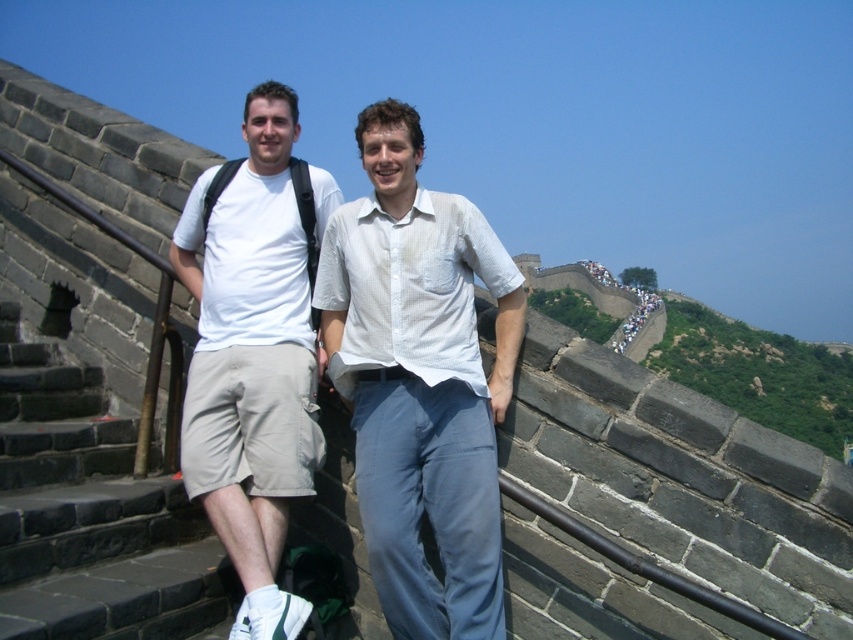
You are a photographer trying to capture a wide shot of the scene. You notice the white cotton shirt at center and the black stone stairs at lower left. Which object should you focus on to ensure both are in frame without cropping, considering their widths?

The white cotton shirt at center has a greater width than the black stone stairs at lower left, so focusing on the wider object, the white cotton shirt at center, would ensure both fit in the frame without cropping.